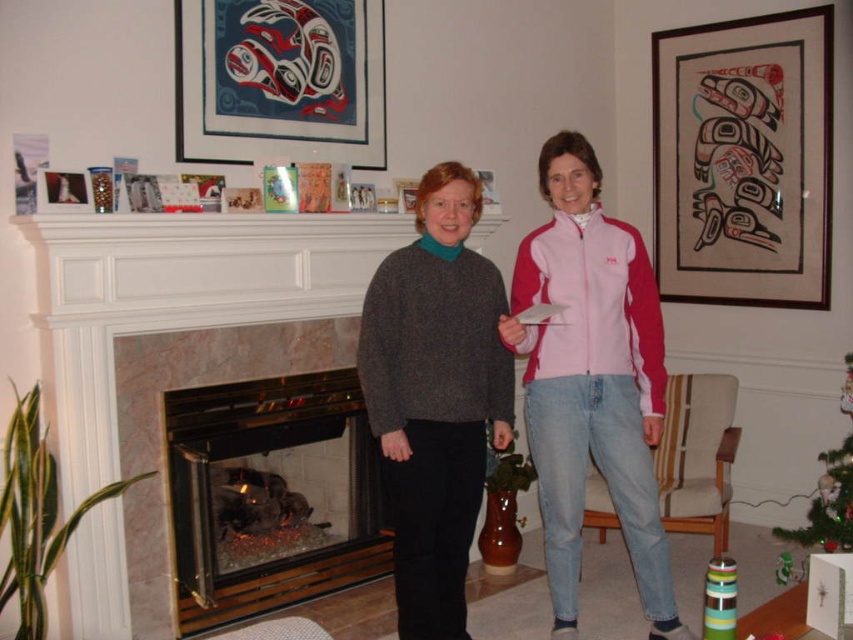
Who is higher up, pink fleece jacket at center or matte plastic picture frame at upper center?

Positioned higher is matte plastic picture frame at upper center.

Measure the distance from pink fleece jacket at center to matte plastic picture frame at upper center.

A distance of 1.43 meters exists between pink fleece jacket at center and matte plastic picture frame at upper center.

What do you see at coordinates (590, 380) in the screenshot? I see `pink fleece jacket at center` at bounding box center [590, 380].

I want to click on pink fleece jacket at center, so coord(590,380).

Between matte plastic picture frame at upper center and green matte christmas tree at lower right, which one has less height?

matte plastic picture frame at upper center

Between point (264, 124) and point (795, 541), which one is positioned behind?

The point (795, 541) is behind.

In order to click on matte plastic picture frame at upper center in this screenshot , I will do `click(280, 80)`.

Can you confirm if pink fleece jacket at center is thinner than wooden fireplace at center?

Yes, pink fleece jacket at center is thinner than wooden fireplace at center.

Does pink fleece jacket at center have a larger size compared to wooden fireplace at center?

Yes.

The image size is (853, 640). Describe the element at coordinates (590, 380) in the screenshot. I see `pink fleece jacket at center` at that location.

Where is `pink fleece jacket at center`? The width and height of the screenshot is (853, 640). pink fleece jacket at center is located at coordinates (590, 380).